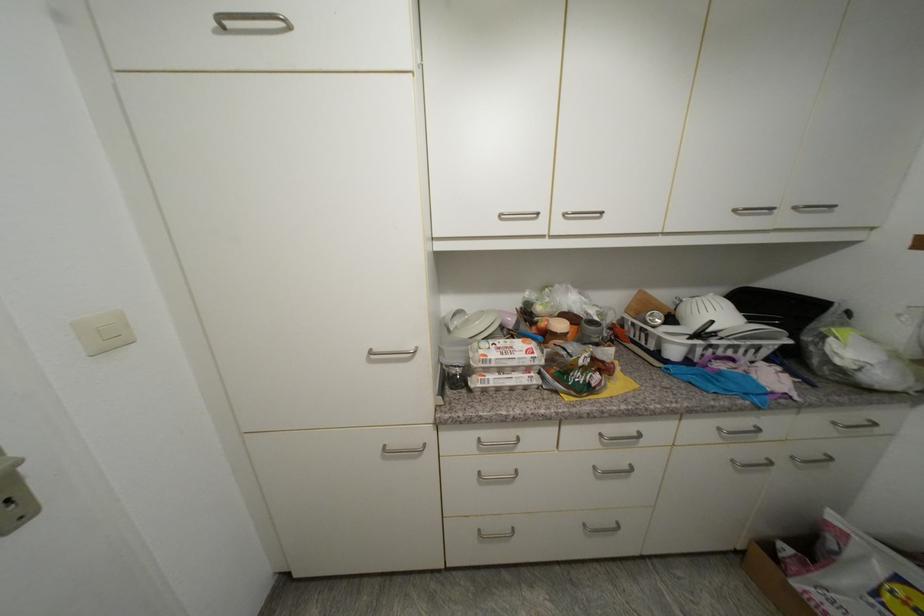
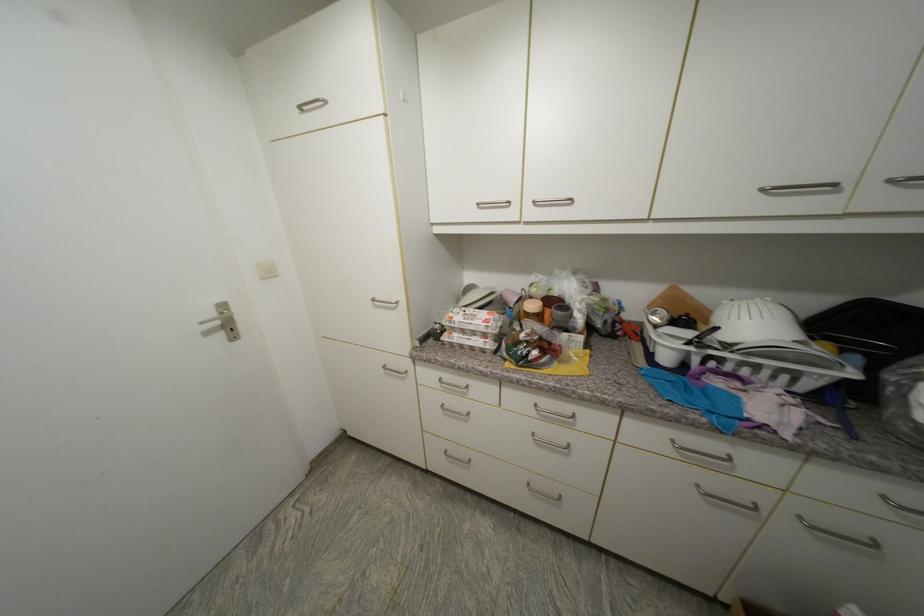
In the second image, find the point that corresponds to [650,294] in the first image.

(685, 292)